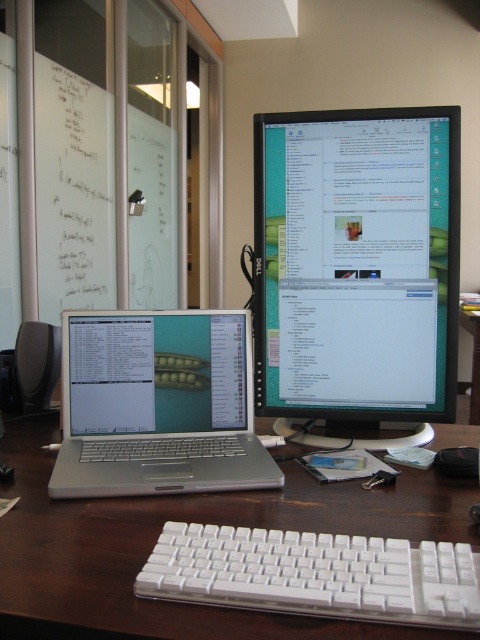
Question: Can you confirm if white plastic keyboard at center is smaller than brown wooden table at center?

Choices:
 (A) yes
 (B) no

Answer: (A)

Question: Among these objects, which one is nearest to the camera?

Choices:
 (A) silver metallic laptop at left
 (B) white plastic keyboard at center
 (C) matte black monitor at upper right

Answer: (B)

Question: Which of the following is the farthest from the observer?

Choices:
 (A) matte black monitor at upper right
 (B) white plastic keyboard at center

Answer: (A)

Question: Based on their relative distances, which object is farther from the silver metallic laptop at left?

Choices:
 (A) matte black monitor at upper right
 (B) brown wooden table at center
 (C) white plastic keyboard at lower center
 (D) white plastic keyboard at center

Answer: (B)

Question: Can you confirm if white plastic keyboard at lower center is positioned above white plastic keyboard at center?

Choices:
 (A) yes
 (B) no

Answer: (B)

Question: Does matte black monitor at upper right have a larger size compared to brown wooden table at center?

Choices:
 (A) yes
 (B) no

Answer: (B)